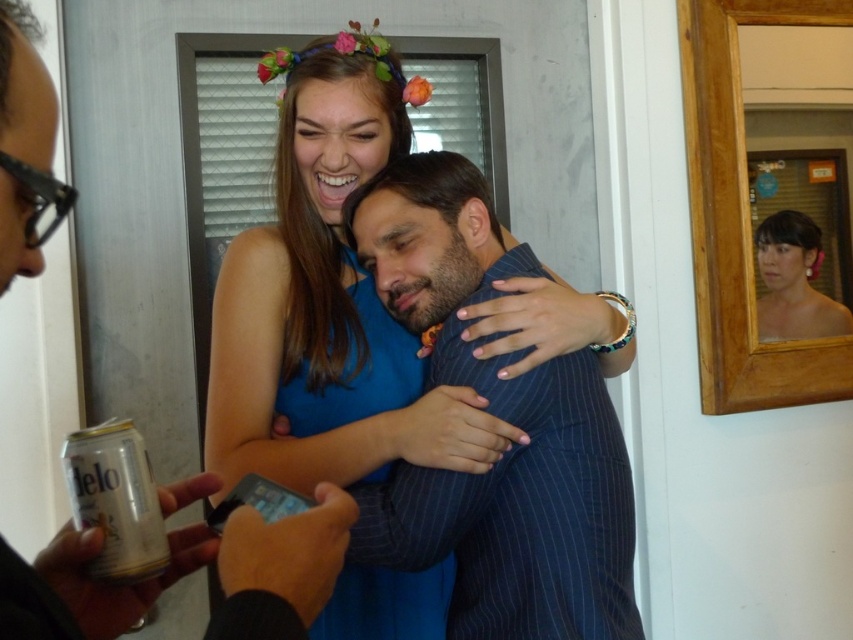
What are the coordinates of the blue striped suit at center?

The blue striped suit at center is located at coordinates (502, 419).

You are standing at the origin point in the image. Which of the two points, point (416, 547) or point (207, 476), is located behind the other?

Point (416, 547) is behind point (207, 476).